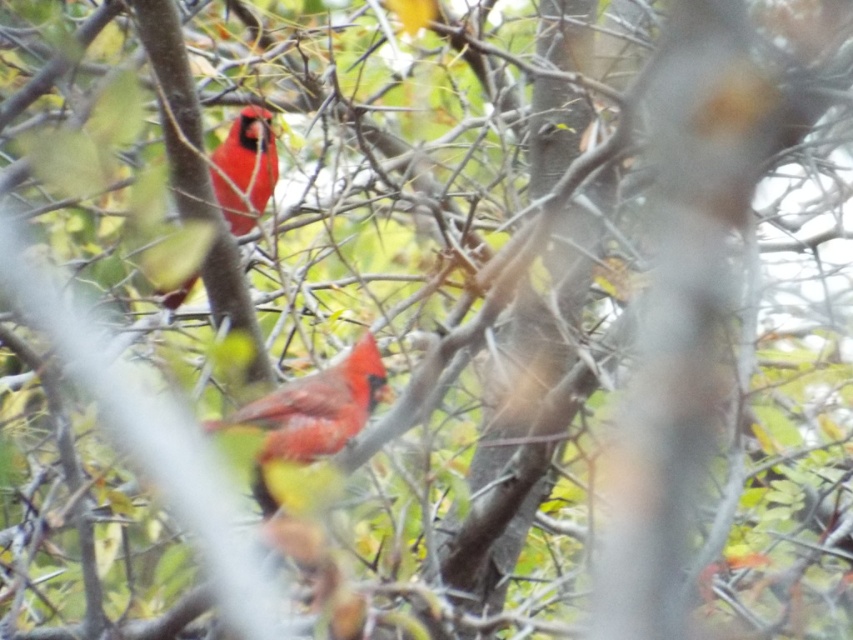
Question: Which point is farther to the camera?

Choices:
 (A) matte red cardinal at upper left
 (B) matte red cardinal at center

Answer: (A)

Question: Does matte red cardinal at center appear over matte red cardinal at upper left?

Choices:
 (A) no
 (B) yes

Answer: (A)

Question: Which of the following is the closest to the observer?

Choices:
 (A) (289, 452)
 (B) (245, 166)

Answer: (A)

Question: Can you confirm if matte red cardinal at center is positioned to the left of matte red cardinal at upper left?

Choices:
 (A) yes
 (B) no

Answer: (B)

Question: Does matte red cardinal at center have a lesser width compared to matte red cardinal at upper left?

Choices:
 (A) yes
 (B) no

Answer: (B)

Question: Which point is closer to the camera taking this photo?

Choices:
 (A) (254, 109)
 (B) (367, 340)

Answer: (B)